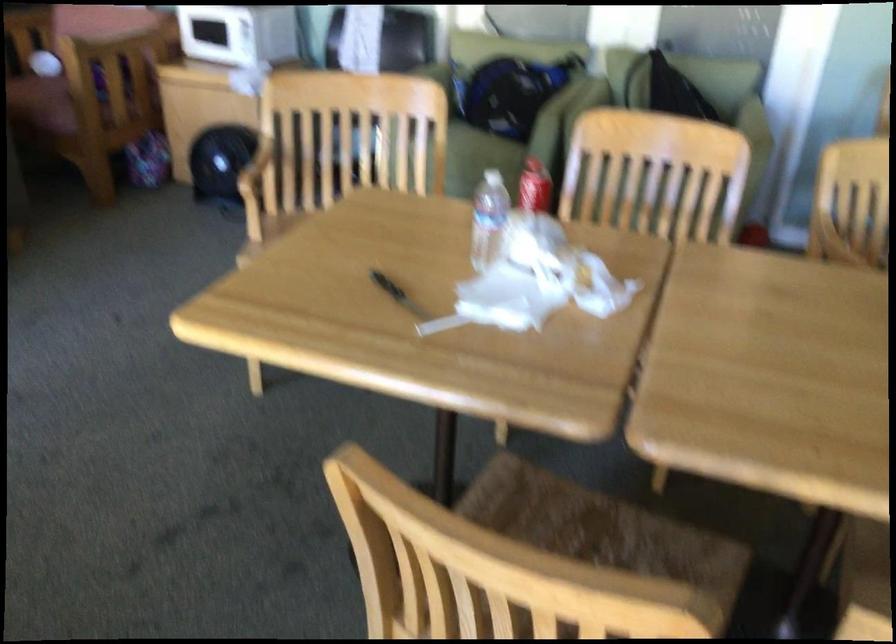
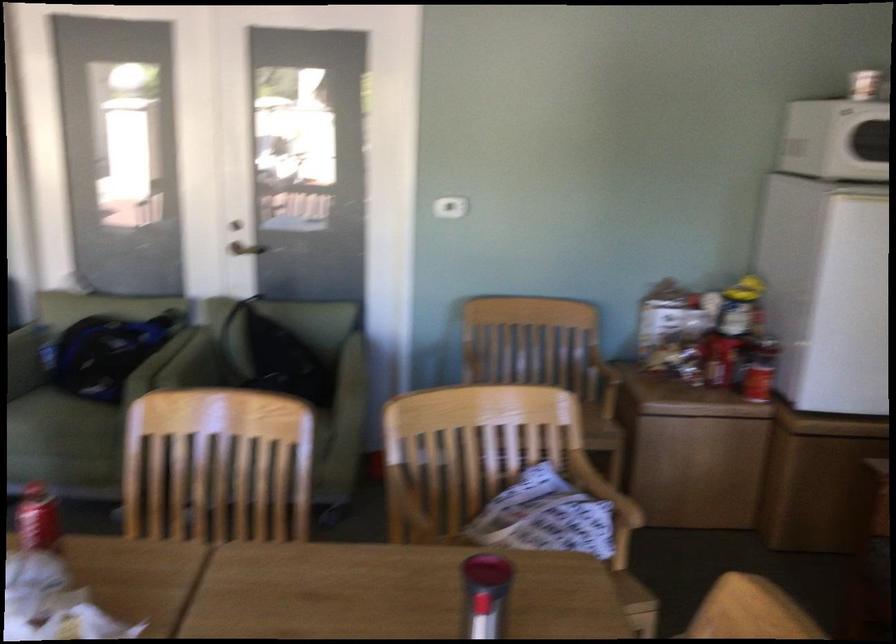
Where in the second image is the point corresponding to pixel 683 106 from the first image?

(282, 359)